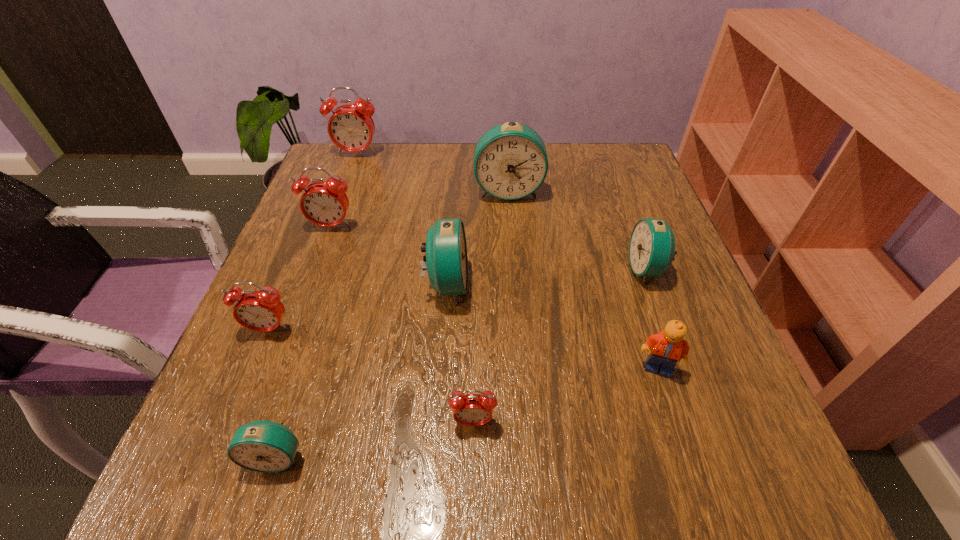
Identify which alarm clock is the nearest to the rightmost blue alarm clock. Please provide its 2D coordinates. Your answer should be formatted as a tuple, i.e. [(x, y)], where the tuple contains the x and y coordinates of a point satisfying the conditions above.

[(510, 161)]

Identify which alarm clock is located as the sixth nearest to the rightmost red alarm clock. Please provide its 2D coordinates. Your answer should be formatted as a tuple, i.e. [(x, y)], where the tuple contains the x and y coordinates of a point satisfying the conditions above.

[(510, 161)]

Identify the location of red alarm clock that stands as the closest to the second nearest red alarm clock. The width and height of the screenshot is (960, 540). (325, 204).

Where is `red alarm clock that is the third closest to the seventh farthest alarm clock`? The width and height of the screenshot is (960, 540). red alarm clock that is the third closest to the seventh farthest alarm clock is located at coordinates (350, 127).

This screenshot has height=540, width=960. Find the location of `blue alarm clock that stands as the second closest to the second smallest red alarm clock`. blue alarm clock that stands as the second closest to the second smallest red alarm clock is located at coordinates (446, 258).

Choose which blue alarm clock is the second nearest neighbor to the farthest object. Please provide its 2D coordinates. Your answer should be formatted as a tuple, i.e. [(x, y)], where the tuple contains the x and y coordinates of a point satisfying the conditions above.

[(446, 258)]

Identify the location of free point that satisfies the following two spatial constraints: 1. on the front-facing side of the third blue alarm clock from right to left; 2. on the face of the sixth farthest alarm clock. This screenshot has width=960, height=540. (444, 329).